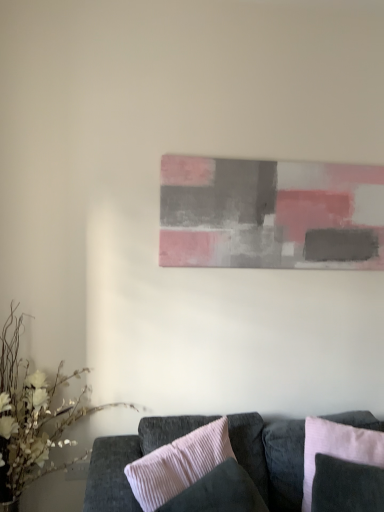
Question: Is pink corduroy pillow at center, which ranks as the 1th pillow in left-to-right order, smaller than pink corduroy pillow at lower right, which is the 2th pillow in left-to-right order?

Choices:
 (A) no
 (B) yes

Answer: (A)

Question: Can you confirm if pink corduroy pillow at center, the 2th pillow when ordered from right to left, is taller than pink corduroy pillow at lower right, which is the 2th pillow in left-to-right order?

Choices:
 (A) yes
 (B) no

Answer: (A)

Question: Is pink corduroy pillow at center, which ranks as the 1th pillow in left-to-right order, not inside pink corduroy pillow at lower right, which is the 2th pillow in left-to-right order?

Choices:
 (A) no
 (B) yes

Answer: (B)

Question: Does pink corduroy pillow at center, which ranks as the 1th pillow in left-to-right order, come behind pink corduroy pillow at lower right, which is the 1th pillow from right to left?

Choices:
 (A) yes
 (B) no

Answer: (B)

Question: Considering the relative positions of pink corduroy pillow at center, the 2th pillow when ordered from right to left, and pink corduroy pillow at lower right, which is the 2th pillow in left-to-right order, in the image provided, is pink corduroy pillow at center, the 2th pillow when ordered from right to left, to the left of pink corduroy pillow at lower right, which is the 2th pillow in left-to-right order, from the viewer's perspective?

Choices:
 (A) yes
 (B) no

Answer: (A)

Question: From the image's perspective, is pink corduroy pillow at center, the 2th pillow when ordered from right to left, beneath pink corduroy pillow at lower right, which is the 1th pillow from right to left?

Choices:
 (A) no
 (B) yes

Answer: (B)

Question: Would you say pink corduroy pillow at lower right, which is the 1th pillow from right to left, is outside velvet dark gray couch at lower center?

Choices:
 (A) no
 (B) yes

Answer: (A)

Question: From the image's perspective, is pink corduroy pillow at lower right, which is the 2th pillow in left-to-right order, below velvet dark gray couch at lower center?

Choices:
 (A) yes
 (B) no

Answer: (B)

Question: Is pink corduroy pillow at lower right, which is the 2th pillow in left-to-right order, looking in the opposite direction of velvet dark gray couch at lower center?

Choices:
 (A) no
 (B) yes

Answer: (B)

Question: Is pink corduroy pillow at lower right, which is the 2th pillow in left-to-right order, shorter than velvet dark gray couch at lower center?

Choices:
 (A) yes
 (B) no

Answer: (A)

Question: From the image's perspective, is pink corduroy pillow at lower right, which is the 2th pillow in left-to-right order, over velvet dark gray couch at lower center?

Choices:
 (A) no
 (B) yes

Answer: (B)

Question: Is pink corduroy pillow at lower right, which is the 2th pillow in left-to-right order, at the left side of velvet dark gray couch at lower center?

Choices:
 (A) yes
 (B) no

Answer: (B)

Question: Is pink corduroy pillow at center, the 2th pillow when ordered from right to left, directly adjacent to matte gray painting at center?

Choices:
 (A) yes
 (B) no

Answer: (B)